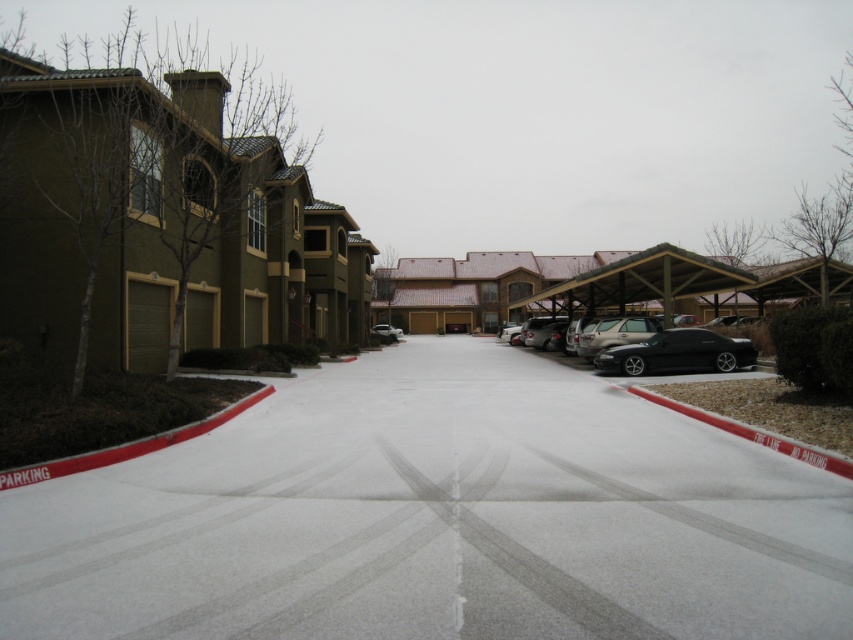
You are a delivery driver who needs to park your satin gold suv at center in the white asphalt parking lot at center. Is there enough space for the SUV to fit into the parking lot?

The white asphalt parking lot at center is located below the satin gold suv at center, which means the SUV is already parked there. Therefore, there is sufficient space for the SUV to fit into the parking lot.

You are a delivery driver who needs to park your truck in the parking lot. Your truck is 6 meters long. The shiny black sedan at center and the black matte car at right are blocking the parking spot. Can you fit your truck between them?

The shiny black sedan at center is larger than the black matte car at right. However, the distance between them is not specified in the provided information, so it is impossible to determine if the truck can fit.